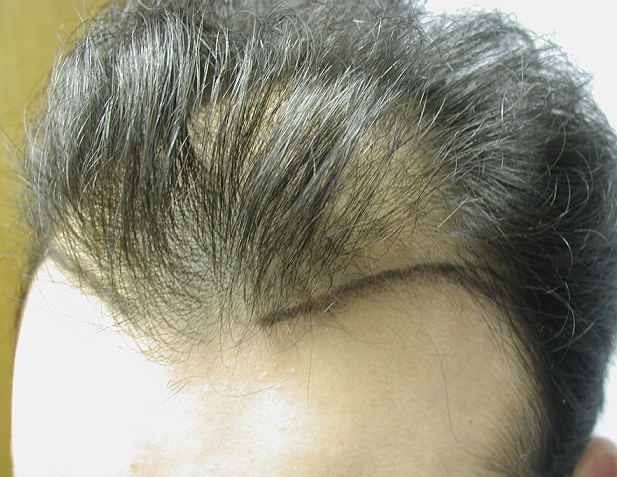
I want to click on white wall, so click(x=597, y=33).